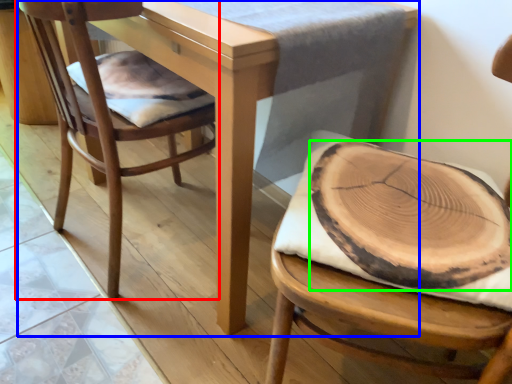
Question: Which is nearer to the chair (highlighted by a red box)? table (highlighted by a blue box) or food (highlighted by a green box).

Choices:
 (A) table
 (B) food

Answer: (A)